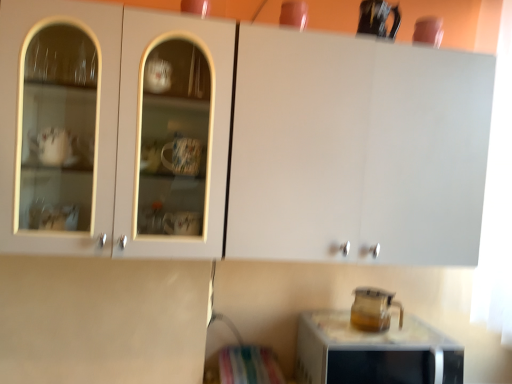
Where is `free space that is to the left of transparent glass pitcher at lower right`? free space that is to the left of transparent glass pitcher at lower right is located at coordinates (331, 331).